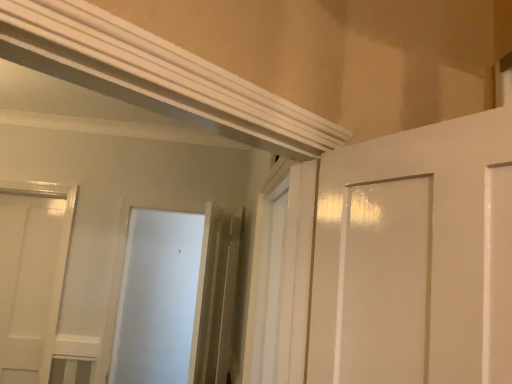
This screenshot has height=384, width=512. Describe the element at coordinates (157, 297) in the screenshot. I see `white glossy screen door at center` at that location.

Where is `white glossy screen door at center`? Image resolution: width=512 pixels, height=384 pixels. white glossy screen door at center is located at coordinates (157, 297).

At what (x,y) coordinates should I click in order to perform the action: click on white glossy screen door at center. Please return your answer as a coordinate pair (x, y). This screenshot has height=384, width=512. Looking at the image, I should click on (157, 297).